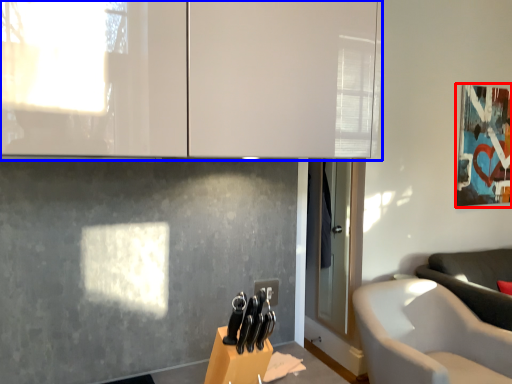
Question: Which point is closer to the camera, picture frame (highlighted by a red box) or cabinetry (highlighted by a blue box)?

Choices:
 (A) picture frame
 (B) cabinetry

Answer: (B)